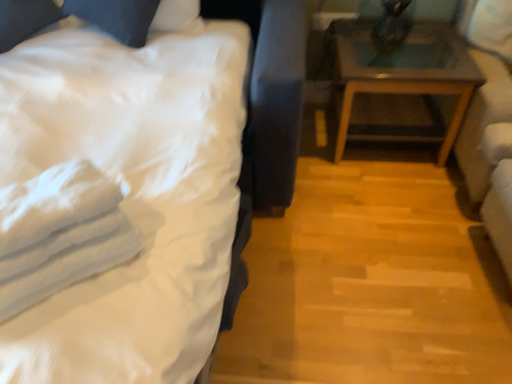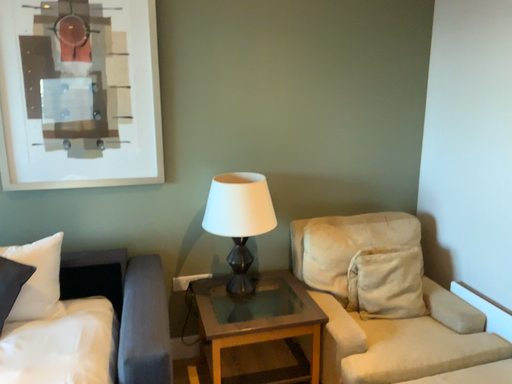
Question: Which way did the camera rotate in the video?

Choices:
 (A) rotated downward
 (B) rotated upward

Answer: (B)